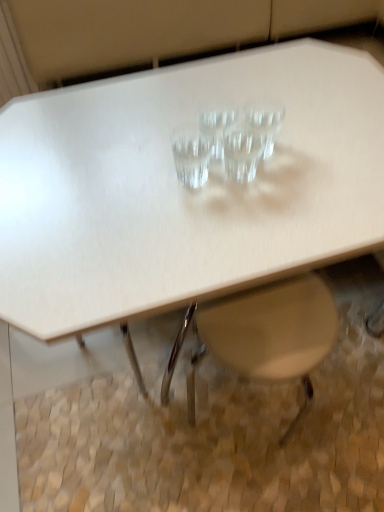
The height and width of the screenshot is (512, 384). I want to click on free location to the right of transparent glass martini glass at center, acting as the 4th martini glass starting from the left, so click(327, 144).